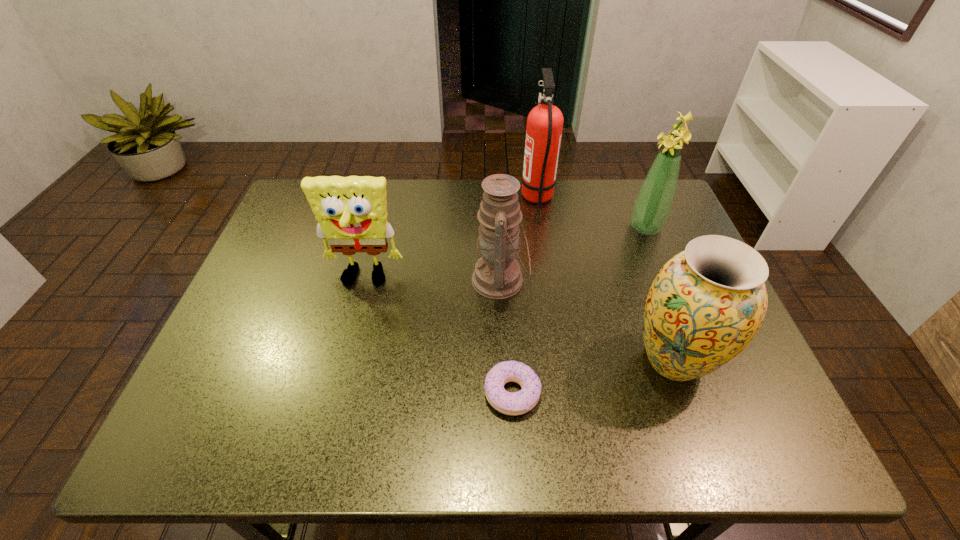
Locate an element on the screen. Image resolution: width=960 pixels, height=540 pixels. bouquet located at the right edge is located at coordinates (652, 207).

The width and height of the screenshot is (960, 540). In order to click on vase that is at the right edge in this screenshot , I will do `click(706, 304)`.

This screenshot has height=540, width=960. Identify the location of object at the far right corner. (652, 207).

I want to click on free region at the far edge, so click(467, 224).

Where is `vacant space at the left edge of the desktop`? vacant space at the left edge of the desktop is located at coordinates (260, 287).

Locate an element on the screen. The height and width of the screenshot is (540, 960). vacant space at the right edge of the desktop is located at coordinates (680, 230).

Identify the location of free location at the near left corner of the desktop. click(x=229, y=449).

In order to click on empty location between the fire extinguisher and the vase in this screenshot , I will do [606, 279].

Find the location of a particular element. free space between the vase and the fire extinguisher is located at coordinates (606, 279).

Identify the location of unoccupied position between the leftmost object and the oil lamp. (432, 280).